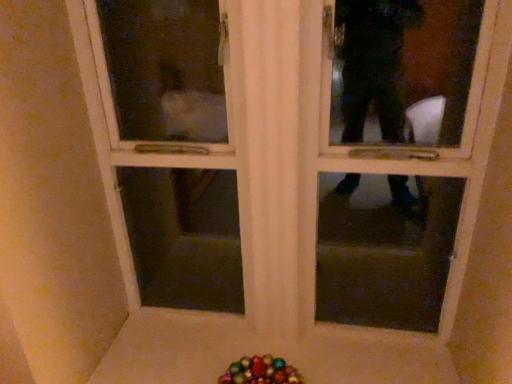
Question: Should I look upward or downward to see multicolored glass beads at lower center?

Choices:
 (A) up
 (B) down

Answer: (B)